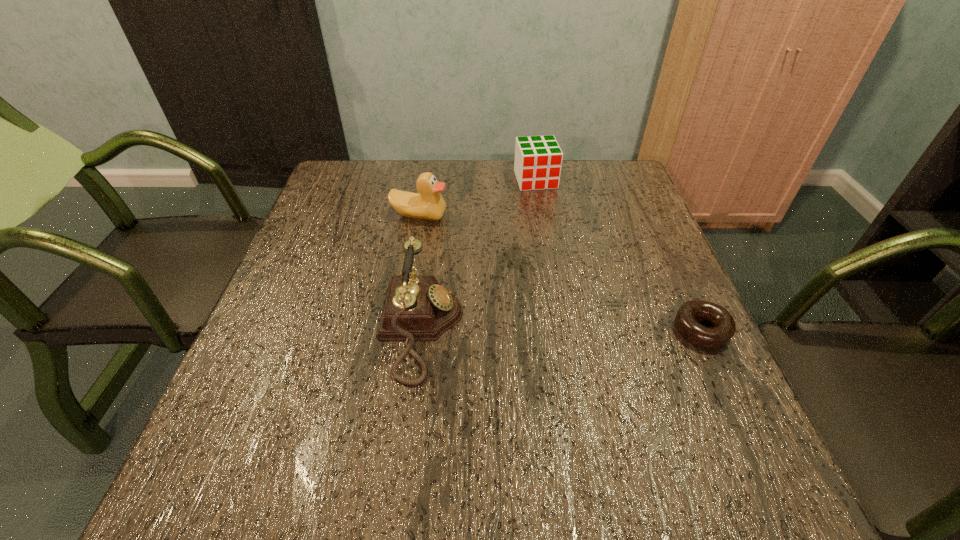
Locate an element on the screen. The width and height of the screenshot is (960, 540). unoccupied position between the third object from left to right and the duck is located at coordinates (477, 198).

You are a GUI agent. You are given a task and a screenshot of the screen. Output one action in this format:
    pyautogui.click(x=<x>, y=<y>)
    Task: Click on the unoccupied area between the shortest object and the cube
    The width and height of the screenshot is (960, 540).
    Given the screenshot: What is the action you would take?
    pyautogui.click(x=619, y=255)

The height and width of the screenshot is (540, 960). Identify the location of free space between the second object from right to left and the telephone. (478, 254).

Where is `object that is the third closest one to the duck`? Image resolution: width=960 pixels, height=540 pixels. object that is the third closest one to the duck is located at coordinates (724, 327).

Identify the location of object identified as the third closest to the tallest object. (724, 327).

The image size is (960, 540). Identify the location of vacant area in the image that satisfies the following two spatial constraints: 1. on the front side of the tallest object; 2. on the dial of the third nearest object. [400, 329].

Image resolution: width=960 pixels, height=540 pixels. Identify the location of vacant area in the image that satisfies the following two spatial constraints: 1. on the front side of the shortest object; 2. on the right side of the third object from left to right. (561, 330).